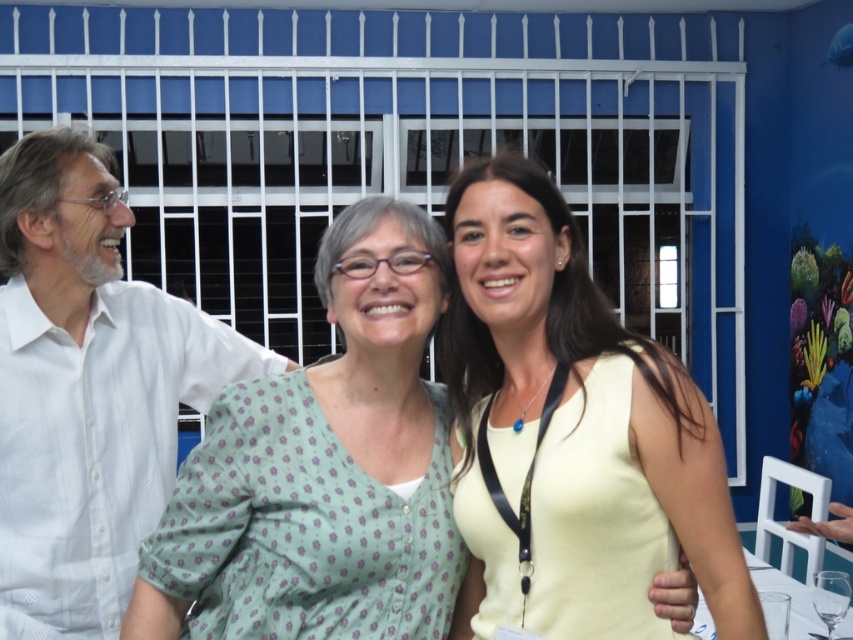
Between point (158, 589) and point (820, 580), which one is positioned in front?

Point (158, 589)

Is green floral blouse at center further to camera compared to transparent glass at lower right?

That is False.

Identify the location of green floral blouse at center. (322, 468).

Based on the photo, can you confirm if yellow matte tank top at center is positioned above white textured shirt at left?

Actually, yellow matte tank top at center is below white textured shirt at left.

Looking at this image, is yellow matte tank top at center bigger than white textured shirt at left?

No, yellow matte tank top at center is not bigger than white textured shirt at left.

Who is more forward, (511,586) or (44,292)?

Point (511,586) is in front.

At what (x,y) coordinates should I click in order to perform the action: click on yellow matte tank top at center. Please return your answer as a coordinate pair (x, y). Looking at the image, I should click on (572, 435).

Which is in front, point (151, 449) or point (848, 577)?

Positioned in front is point (151, 449).

Can you confirm if white textured shirt at left is positioned below transparent glass at lower right?

No, white textured shirt at left is not below transparent glass at lower right.

What do you see at coordinates (86, 390) in the screenshot?
I see `white textured shirt at left` at bounding box center [86, 390].

Locate an element on the screen. This screenshot has height=640, width=853. white textured shirt at left is located at coordinates (86, 390).